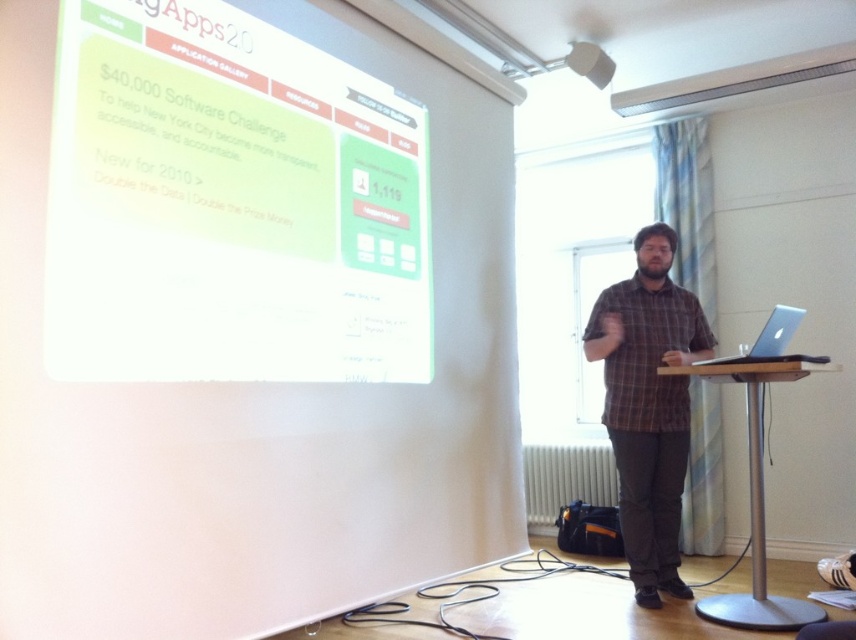
You are a photographer positioned at the camera. You need to capture a closeup of the silver metallic laptop at right without moving the camera. Can you do it with a standard zoom lens that has a maximum zoom of 200mm?

The silver metallic laptop at right is 3.02 meters away from the camera. With a standard zoom lens up to 200mm, it is possible to capture a closeup without moving the camera, as 200mm provides sufficient magnification for this distance.

You are attending a presentation and need to locate the silver metallic laptop at right. According to the coordinates given, where exactly is it placed in the image?

The silver metallic laptop at right is located at coordinates point (x=768, y=339).